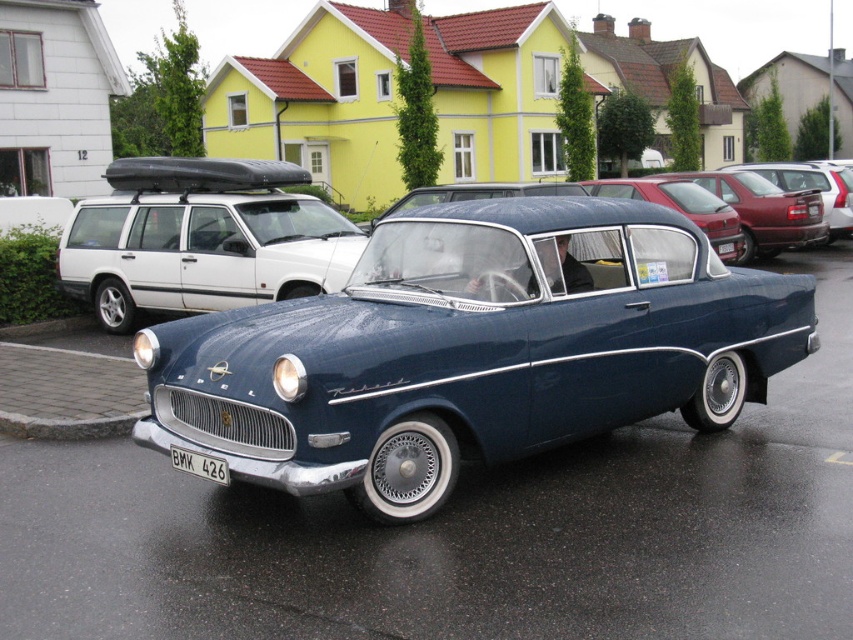
Question: Can you confirm if metallic blue car at center is thinner than metallic blue sedan at center?

Choices:
 (A) no
 (B) yes

Answer: (A)

Question: Among these points, which one is nearest to the camera?

Choices:
 (A) (672, 177)
 (B) (828, 230)

Answer: (A)

Question: Does blue metallic car at center come in front of white plastic license plate at center?

Choices:
 (A) no
 (B) yes

Answer: (A)

Question: Considering the relative positions of metallic blue sedan at center and blue metallic car at center in the image provided, where is metallic blue sedan at center located with respect to blue metallic car at center?

Choices:
 (A) right
 (B) left

Answer: (A)

Question: Which object appears closest to the camera in this image?

Choices:
 (A) white plastic license plate at center
 (B) metallic blue car at center
 (C) blue metallic car at center
 (D) metallic blue sedan at center

Answer: (B)

Question: Among these objects, which one is farthest from the camera?

Choices:
 (A) matte red station wagon at right
 (B) blue metallic car at center

Answer: (A)